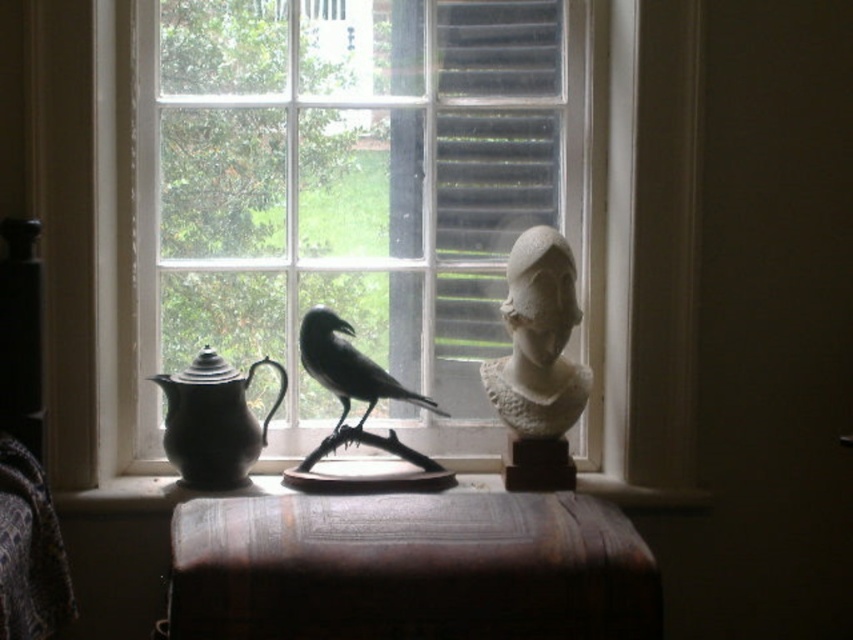
Can you confirm if matte black teapot at left is bigger than wooden surface at center?

Correct, matte black teapot at left is larger in size than wooden surface at center.

Is matte black teapot at left taller than wooden surface at center?

Indeed, matte black teapot at left has a greater height compared to wooden surface at center.

The image size is (853, 640). I want to click on matte black teapot at left, so click(x=213, y=420).

Where is `matte black teapot at left`? The width and height of the screenshot is (853, 640). matte black teapot at left is located at coordinates (213, 420).

Can you confirm if wooden surface at center is positioned below white stone bust at center?

Indeed, wooden surface at center is positioned under white stone bust at center.

From the picture: Which is below, wooden surface at center or white stone bust at center?

wooden surface at center

Which is in front, point (80, 502) or point (531, 289)?

Positioned in front is point (531, 289).

Locate an element on the screen. wooden surface at center is located at coordinates (149, 493).

Which of these two, clear glass window at center or wooden surface at center, stands shorter?

wooden surface at center is shorter.

What do you see at coordinates (364, 188) in the screenshot? This screenshot has width=853, height=640. I see `clear glass window at center` at bounding box center [364, 188].

Identify the location of clear glass window at center. (364, 188).